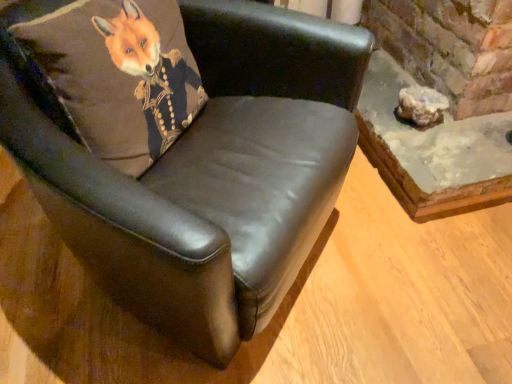
Question: Does translucent white rock at lower right come behind brown leather pillow at upper left?

Choices:
 (A) no
 (B) yes

Answer: (B)

Question: Can you confirm if translucent white rock at lower right is wider than brown leather pillow at upper left?

Choices:
 (A) yes
 (B) no

Answer: (B)

Question: Is translucent white rock at lower right at the right side of brown leather pillow at upper left?

Choices:
 (A) yes
 (B) no

Answer: (A)

Question: Would you say translucent white rock at lower right is outside brown leather pillow at upper left?

Choices:
 (A) no
 (B) yes

Answer: (B)

Question: Considering the relative sizes of translucent white rock at lower right and brown leather pillow at upper left in the image provided, is translucent white rock at lower right smaller than brown leather pillow at upper left?

Choices:
 (A) yes
 (B) no

Answer: (A)

Question: From a real-world perspective, is translucent white rock at lower right beneath brown leather pillow at upper left?

Choices:
 (A) yes
 (B) no

Answer: (A)

Question: Is translucent white rock at lower right at the right side of rustic concrete table at lower right?

Choices:
 (A) no
 (B) yes

Answer: (A)

Question: Is translucent white rock at lower right bigger than rustic concrete table at lower right?

Choices:
 (A) no
 (B) yes

Answer: (A)

Question: Would you say rustic concrete table at lower right is part of translucent white rock at lower right's contents?

Choices:
 (A) yes
 (B) no

Answer: (B)

Question: Can you confirm if translucent white rock at lower right is positioned to the left of rustic concrete table at lower right?

Choices:
 (A) yes
 (B) no

Answer: (A)

Question: Does translucent white rock at lower right have a lesser width compared to rustic concrete table at lower right?

Choices:
 (A) yes
 (B) no

Answer: (A)

Question: Is translucent white rock at lower right aimed at rustic concrete table at lower right?

Choices:
 (A) yes
 (B) no

Answer: (B)

Question: Are black leather chair at upper left and brown leather pillow at upper left beside each other?

Choices:
 (A) yes
 (B) no

Answer: (B)